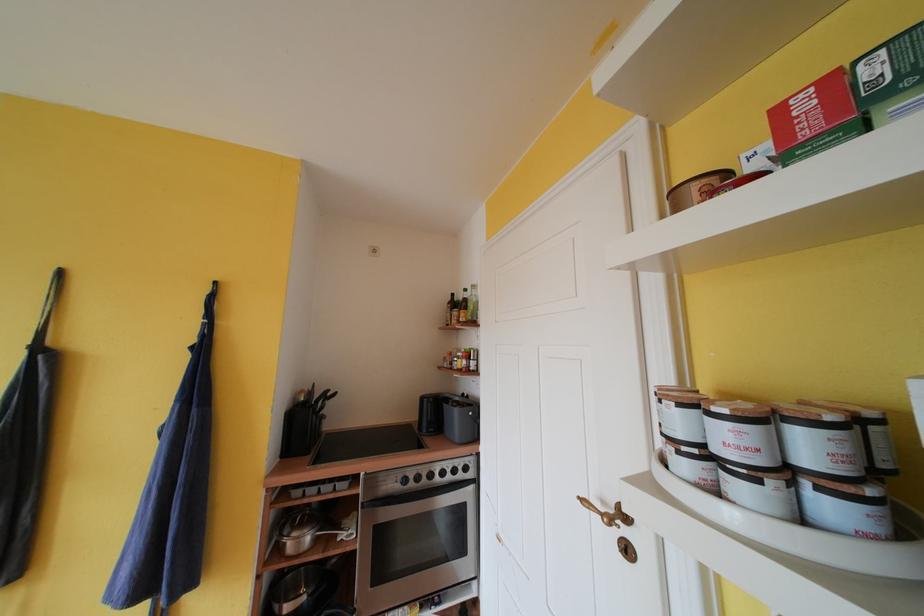
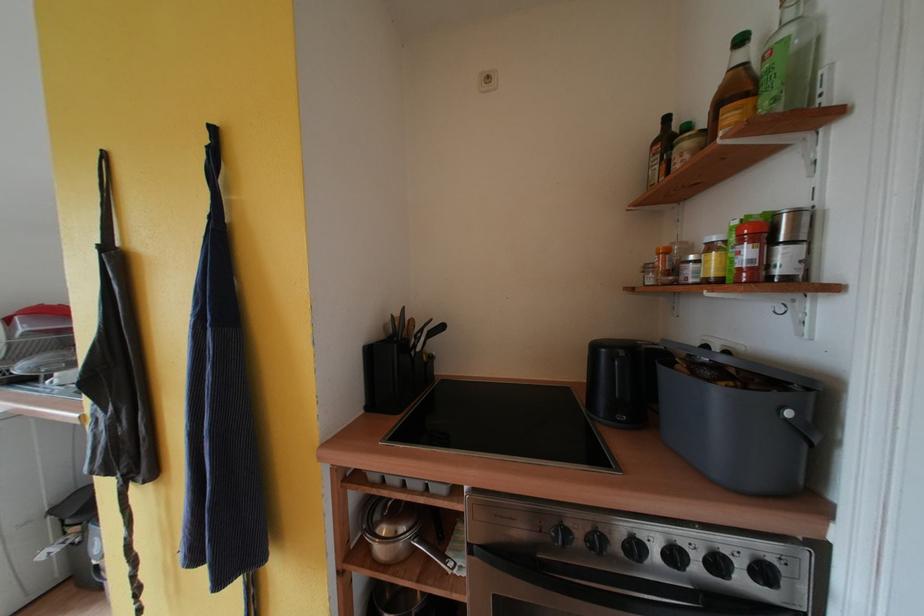
In the second image, find the point that corresponds to pixel 471 294 in the first image.

(748, 44)